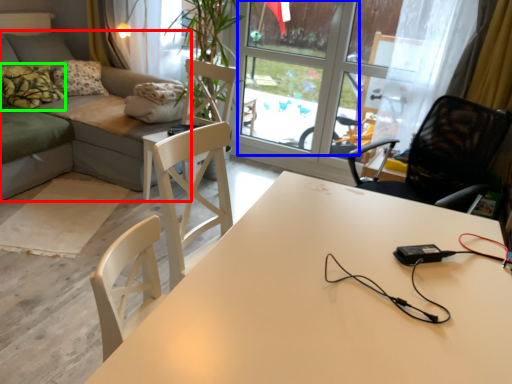
Question: Considering the real-world distances, which object is farthest from studio couch (highlighted by a red box)? window screen (highlighted by a blue box) or pillow (highlighted by a green box)?

Choices:
 (A) window screen
 (B) pillow

Answer: (A)